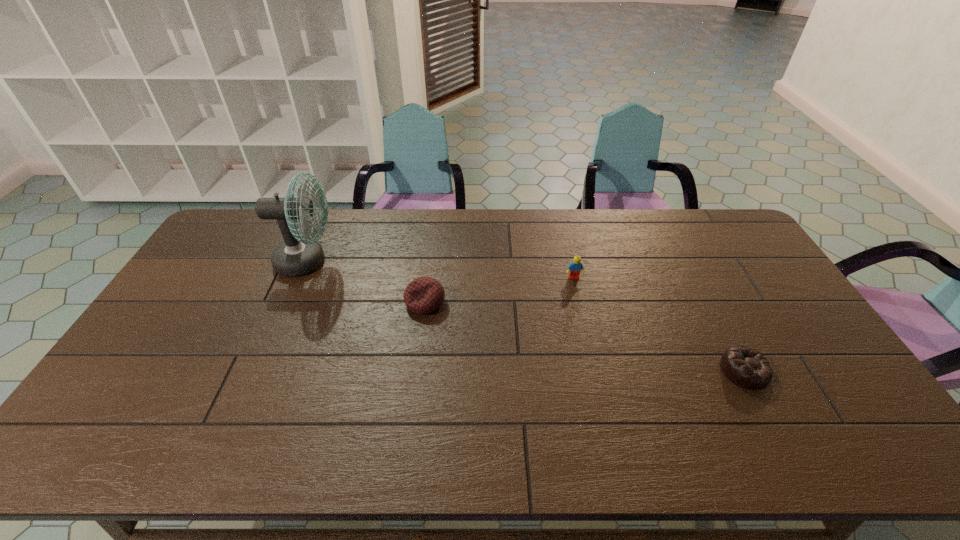
Where is `the tallest object`? This screenshot has width=960, height=540. the tallest object is located at coordinates (295, 256).

Where is `fan`? This screenshot has width=960, height=540. fan is located at coordinates (295, 256).

Where is `the third object from left to right`? This screenshot has width=960, height=540. the third object from left to right is located at coordinates (574, 268).

You are a GUI agent. You are given a task and a screenshot of the screen. Output one action in this format:
    pyautogui.click(x=<x>, y=<y>)
    Task: Click on the third shortest object
    This screenshot has width=960, height=540.
    Given the screenshot: What is the action you would take?
    pyautogui.click(x=574, y=268)

The width and height of the screenshot is (960, 540). What are the coordinates of `the taller beanbag` in the screenshot? It's located at (423, 295).

Where is `the farther beanbag`? the farther beanbag is located at coordinates (423, 295).

Identify the location of the shorter beanbag. (745, 367).

Where is `the nearer beanbag`? The height and width of the screenshot is (540, 960). the nearer beanbag is located at coordinates (745, 367).

Locate an element on the screen. blank space located in front of the fan where the airflow is directed is located at coordinates (400, 261).

Image resolution: width=960 pixels, height=540 pixels. Identify the location of free location located 0.260m on the face of the second object from right to left. (588, 343).